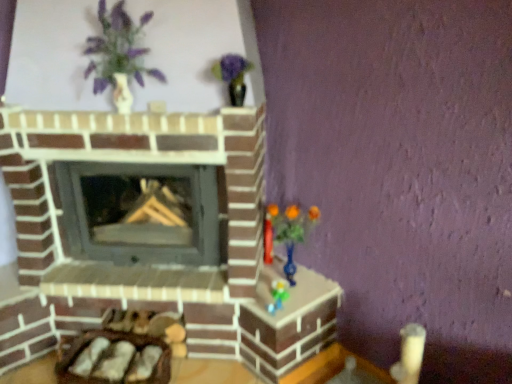
Find the location of `space that is in front of translucent blue vase at right`. space that is in front of translucent blue vase at right is located at coordinates pos(292,306).